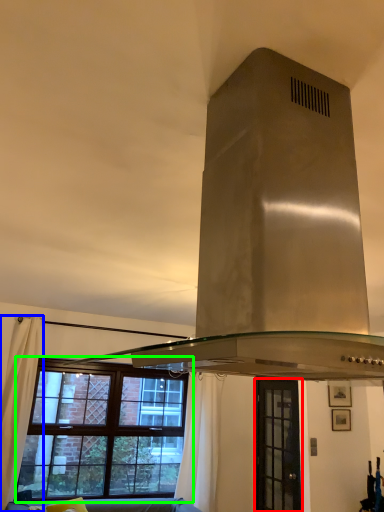
Question: Which is farther away from window (highlighted by a red box)? curtain (highlighted by a blue box) or window (highlighted by a green box)?

Choices:
 (A) curtain
 (B) window

Answer: (A)